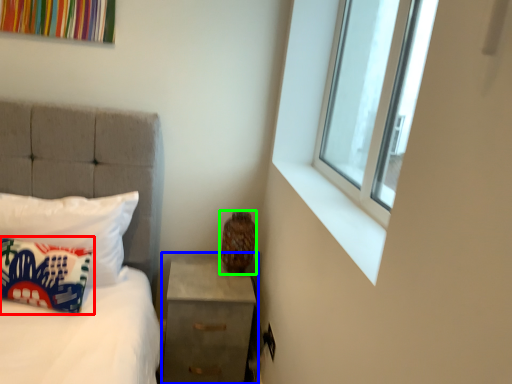
Question: Which is farther away from pillow (highlighted by a red box)? nightstand (highlighted by a blue box) or vase (highlighted by a green box)?

Choices:
 (A) nightstand
 (B) vase

Answer: (B)